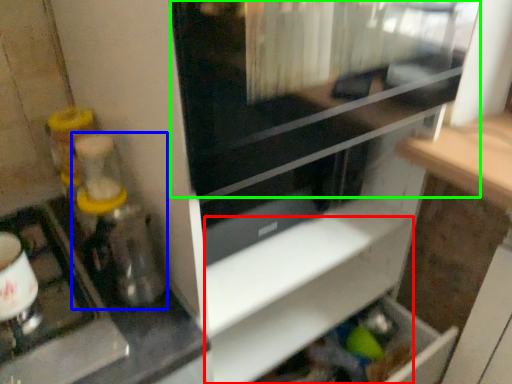
Question: Which is nearer to the shelf (highlighted by a red box)? blender (highlighted by a blue box) or screen door (highlighted by a green box).

Choices:
 (A) blender
 (B) screen door

Answer: (A)